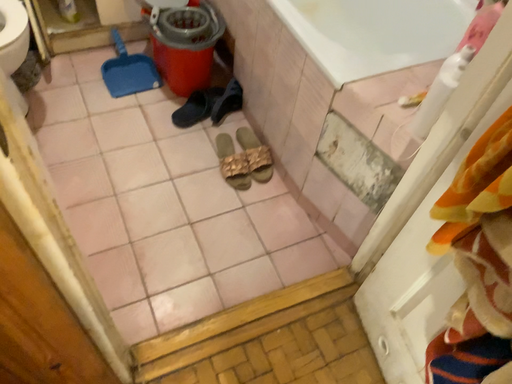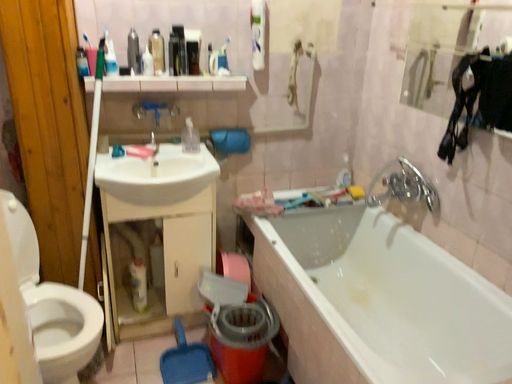
Question: Which way did the camera rotate in the video?

Choices:
 (A) rotated left
 (B) rotated right

Answer: (A)